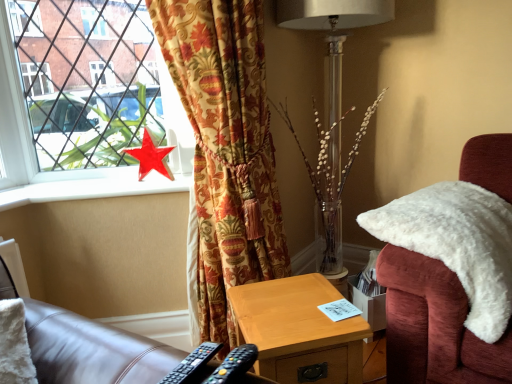
What is the approximate height of metallic silver table lamp at center?

metallic silver table lamp at center is 5.11 feet in height.

What do you see at coordinates (434, 326) in the screenshot?
I see `white fluffy chair at right` at bounding box center [434, 326].

What do you see at coordinates (192, 363) in the screenshot?
I see `black plastic remote control at lower center, the second remote control positioned from the right` at bounding box center [192, 363].

The width and height of the screenshot is (512, 384). What do you see at coordinates (234, 365) in the screenshot?
I see `black plastic remote control at lower center, arranged as the first remote control when viewed from the right` at bounding box center [234, 365].

In order to face wooden nightstand at lower center, should I rotate leftwards or rightwards?

You should rotate right by 5.596 degrees.

Where is `wooden nightstand at lower center`? This screenshot has height=384, width=512. wooden nightstand at lower center is located at coordinates (298, 330).

I want to click on red glossy star at window, so (150, 157).

You are a GUI agent. You are given a task and a screenshot of the screen. Output one action in this format:
    pyautogui.click(x=<x>, y=<y>)
    Task: Click on the metallic silver table lamp at center
    This screenshot has height=384, width=512.
    Given the screenshot: What is the action you would take?
    pyautogui.click(x=332, y=108)

From a real-world perspective, who is located higher, black plastic remote control at lower center, the first remote control in the left-to-right sequence, or metallic silver table lamp at center?

metallic silver table lamp at center is physically above.

In the image, is black plastic remote control at lower center, the first remote control in the left-to-right sequence, positioned in front of or behind metallic silver table lamp at center?

In the image, black plastic remote control at lower center, the first remote control in the left-to-right sequence, appears in front of metallic silver table lamp at center.

From the image's perspective, is black plastic remote control at lower center, the first remote control in the left-to-right sequence, positioned above or below metallic silver table lamp at center?

black plastic remote control at lower center, the first remote control in the left-to-right sequence, is below metallic silver table lamp at center.

Who is more distant, black plastic remote control at lower center, arranged as the first remote control when viewed from the right, or wooden nightstand at lower center?

wooden nightstand at lower center.

In the scene shown: Considering the sizes of objects black plastic remote control at lower center, arranged as the first remote control when viewed from the right, and wooden nightstand at lower center in the image provided, who is wider, black plastic remote control at lower center, arranged as the first remote control when viewed from the right, or wooden nightstand at lower center?

wooden nightstand at lower center.

From a real-world perspective, is black plastic remote control at lower center, arranged as the first remote control when viewed from the right, above or below wooden nightstand at lower center?

In terms of real-world spatial position, black plastic remote control at lower center, arranged as the first remote control when viewed from the right, is above wooden nightstand at lower center.

Considering the sizes of objects black plastic remote control at lower center, which appears as the 2th remote control when viewed from the left, and wooden nightstand at lower center in the image provided, who is smaller, black plastic remote control at lower center, which appears as the 2th remote control when viewed from the left, or wooden nightstand at lower center?

black plastic remote control at lower center, which appears as the 2th remote control when viewed from the left, is smaller.

Between metallic red star at left and velvet floral curtain at left, which one appears on the left side from the viewer's perspective?

Positioned to the left is metallic red star at left.

From a real-world perspective, who is located lower, metallic red star at left or velvet floral curtain at left?

velvet floral curtain at left is physically lower.

Who is smaller, metallic red star at left or velvet floral curtain at left?

With smaller size is metallic red star at left.

Between metallic red star at left and velvet floral curtain at left, which one has more height?

velvet floral curtain at left.

Is black plastic remote control at lower center, arranged as the first remote control when viewed from the right, in contact with red glossy star at window?

No, black plastic remote control at lower center, arranged as the first remote control when viewed from the right, is not beside red glossy star at window.

Based on the photo, is black plastic remote control at lower center, arranged as the first remote control when viewed from the right, further to the viewer compared to red glossy star at window?

No, black plastic remote control at lower center, arranged as the first remote control when viewed from the right, is closer to the viewer.

Looking at this image, can red glossy star at window be found inside black plastic remote control at lower center, arranged as the first remote control when viewed from the right?

Definitely not — red glossy star at window is not inside black plastic remote control at lower center, arranged as the first remote control when viewed from the right.

Is point (234, 371) closer to viewer compared to point (132, 151)?

Yes, it is in front of point (132, 151).

From the picture: Considering the sizes of velvet floral curtain at left and metallic red star at left in the image, is velvet floral curtain at left taller or shorter than metallic red star at left?

Considering their sizes, velvet floral curtain at left has more height than metallic red star at left.

From the image's perspective, which one is positioned lower, velvet floral curtain at left or metallic red star at left?

velvet floral curtain at left.

From a real-world perspective, between velvet floral curtain at left and metallic red star at left, who is vertically higher?

In real-world perspective, metallic red star at left is above.

Looking at this image, from a real-world perspective, is red glossy star at window beneath metallic red star at left?

Indeed, from a real-world perspective, red glossy star at window is positioned beneath metallic red star at left.

Is point (149, 156) closer to viewer compared to point (187, 176)?

Yes, it is.

From a real-world perspective, is red glossy star at window physically below white smooth window sill at upper left?

No, from a real-world perspective, red glossy star at window is not below white smooth window sill at upper left.

Is red glossy star at window in contact with white smooth window sill at upper left?

No, red glossy star at window is not beside white smooth window sill at upper left.

How distant is red glossy star at window from white smooth window sill at upper left?

A distance of 15.50 centimeters exists between red glossy star at window and white smooth window sill at upper left.

The height and width of the screenshot is (384, 512). Identify the location of remote control that is the 1st one below the metallic silver table lamp at center (from a real-world perspective). (192, 363).

In order to click on the 1st remote control directly above the wooden nightstand at lower center (from a real-world perspective) in this screenshot , I will do `click(234, 365)`.

Which object lies nearer to the anchor point wooden nightstand at lower center, black plastic remote control at lower center, which appears as the 2th remote control when viewed from the left, or red glossy star at window?

black plastic remote control at lower center, which appears as the 2th remote control when viewed from the left.

Which object lies further to the anchor point velvet floral curtain at left, white fluffy chair at right or metallic red star at left?

Among the two, white fluffy chair at right is located further to velvet floral curtain at left.

Which object lies further to the anchor point wooden nightstand at lower center, black plastic remote control at lower center, arranged as the first remote control when viewed from the right, or black plastic remote control at lower center, the second remote control positioned from the right?

The object further to wooden nightstand at lower center is black plastic remote control at lower center, the second remote control positioned from the right.

When comparing their distances from wooden nightstand at lower center, does red glossy star at window or metallic silver table lamp at center seem further?

red glossy star at window.

When comparing their distances from metallic silver table lamp at center, does velvet floral curtain at left or wooden nightstand at lower center seem further?

wooden nightstand at lower center is positioned further to the anchor metallic silver table lamp at center.

Based on their spatial positions, is metallic red star at left or white smooth window sill at upper left closer to black plastic remote control at lower center, which appears as the 2th remote control when viewed from the left?

Among the two, white smooth window sill at upper left is located nearer to black plastic remote control at lower center, which appears as the 2th remote control when viewed from the left.

From the image, which object appears to be nearer to velvet floral curtain at left, wooden nightstand at lower center or metallic silver table lamp at center?

Based on the image, wooden nightstand at lower center appears to be nearer to velvet floral curtain at left.

Considering their positions, is metallic silver table lamp at center positioned closer to wooden nightstand at lower center than white smooth window sill at upper left?

metallic silver table lamp at center.

Locate an element on the screen. Image resolution: width=512 pixels, height=384 pixels. remote control positioned between black plastic remote control at lower center, arranged as the first remote control when viewed from the right, and red glossy star at window from near to far is located at coordinates (192, 363).

The image size is (512, 384). What are the coordinates of `curtain situated between white smooth window sill at upper left and metallic silver table lamp at center from left to right` in the screenshot? It's located at (226, 149).

You are a GUI agent. You are given a task and a screenshot of the screen. Output one action in this format:
    pyautogui.click(x=<x>, y=<y>)
    Task: Click on the table lamp between velvet floral curtain at left and white fluffy chair at right
    Image resolution: width=512 pixels, height=384 pixels.
    Given the screenshot: What is the action you would take?
    pyautogui.click(x=332, y=108)

Find the location of `window between velvet floral curtain at left and red glossy star at window along the z-axis`. window between velvet floral curtain at left and red glossy star at window along the z-axis is located at coordinates (83, 104).